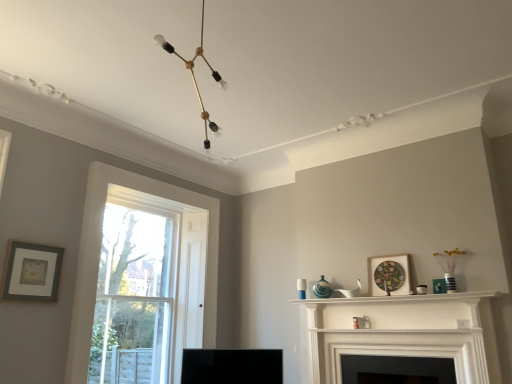
Describe the element at coordinates (401, 299) in the screenshot. I see `white glossy shelf at upper center` at that location.

What do you see at coordinates (32, 272) in the screenshot?
I see `matte gray picture frame at left, the 2th picture frame when ordered from right to left` at bounding box center [32, 272].

Identify the location of matte gray picture frame at left, the 2th picture frame when ordered from right to left. (32, 272).

The width and height of the screenshot is (512, 384). What do you see at coordinates (401, 355) in the screenshot?
I see `black matte fireplace at center, the first fireplace when ordered from bottom to top` at bounding box center [401, 355].

Measure the distance between matte wooden picture frame at upper right, which is the first picture frame in right-to-left order, and camera.

matte wooden picture frame at upper right, which is the first picture frame in right-to-left order, and camera are 3.60 meters apart.

At what (x,y) coordinates should I click in order to perform the action: click on white glossy shelf at upper center. Please return your answer as a coordinate pair (x, y). Looking at the image, I should click on (401, 299).

Can you confirm if clear glass window at left is positioned to the right of white matte fireplace at center, which is the 1th fireplace from top to bottom?

No.

Considering the relative sizes of clear glass window at left and white matte fireplace at center, which is the 1th fireplace from top to bottom, in the image provided, is clear glass window at left bigger than white matte fireplace at center, which is the 1th fireplace from top to bottom,?

Indeed, clear glass window at left has a larger size compared to white matte fireplace at center, which is the 1th fireplace from top to bottom.

Is clear glass window at left facing away from white matte fireplace at center, the 2th fireplace in the bottom-to-top sequence?

No, clear glass window at left is not facing the opposite direction of white matte fireplace at center, the 2th fireplace in the bottom-to-top sequence.

Can you confirm if clear glass window at left is shorter than white matte fireplace at center, which is the 1th fireplace from top to bottom?

No.

Which is farther, (375,350) or (19,248)?

The point (375,350) is more distant.

Is black matte fireplace at center, the first fireplace when ordered from bottom to top, positioned beyond the bounds of matte gray picture frame at left, arranged as the 1th picture frame when viewed from the left?

Yes, black matte fireplace at center, the first fireplace when ordered from bottom to top, is outside of matte gray picture frame at left, arranged as the 1th picture frame when viewed from the left.

Is black matte fireplace at center, the second fireplace when ordered from top to bottom, aimed at matte gray picture frame at left, arranged as the 1th picture frame when viewed from the left?

No.

Find the location of `fireplace that is the 2nd one when counting downward from the matte gray picture frame at left, arranged as the 1th picture frame when viewed from the left (from the image's perspective)`. fireplace that is the 2nd one when counting downward from the matte gray picture frame at left, arranged as the 1th picture frame when viewed from the left (from the image's perspective) is located at coordinates (401, 355).

From the image's perspective, relative to black matte fireplace at center, the second fireplace when ordered from top to bottom, is white glossy shelf at upper center above or below?

Clearly, from the image's perspective, white glossy shelf at upper center is above black matte fireplace at center, the second fireplace when ordered from top to bottom.

Which of these two, white glossy shelf at upper center or black matte fireplace at center, the first fireplace when ordered from bottom to top, is smaller?

With smaller size is white glossy shelf at upper center.

Could you measure the distance between white glossy shelf at upper center and black matte fireplace at center, the first fireplace when ordered from bottom to top?

15.54 inches.

Is black matte fireplace at center, the first fireplace when ordered from bottom to top, surrounded by white glossy shelf at upper center?

No, white glossy shelf at upper center does not contain black matte fireplace at center, the first fireplace when ordered from bottom to top.

Does white matte fireplace at center, which is the 1th fireplace from top to bottom, contain black matte fireplace at center, the first fireplace when ordered from bottom to top?

Definitely not — black matte fireplace at center, the first fireplace when ordered from bottom to top, is not inside white matte fireplace at center, which is the 1th fireplace from top to bottom.

Is point (426, 313) closer or farther from the camera than point (410, 348)?

Clearly, point (426, 313) is more distant from the camera than point (410, 348).

Is white matte fireplace at center, which is the 1th fireplace from top to bottom, facing towards black matte fireplace at center, the first fireplace when ordered from bottom to top?

Yes, white matte fireplace at center, which is the 1th fireplace from top to bottom, is facing black matte fireplace at center, the first fireplace when ordered from bottom to top.

Considering the relative sizes of white glossy shelf at upper center and matte wooden picture frame at upper right, which is the first picture frame in right-to-left order, in the image provided, is white glossy shelf at upper center bigger than matte wooden picture frame at upper right, which is the first picture frame in right-to-left order,?

Yes, white glossy shelf at upper center is bigger than matte wooden picture frame at upper right, which is the first picture frame in right-to-left order.

From the image's perspective, does white glossy shelf at upper center appear lower than matte wooden picture frame at upper right, acting as the 2th picture frame starting from the left?

Yes, from the image's perspective, white glossy shelf at upper center is beneath matte wooden picture frame at upper right, acting as the 2th picture frame starting from the left.

Is white glossy shelf at upper center facing away from matte wooden picture frame at upper right, acting as the 2th picture frame starting from the left?

white glossy shelf at upper center does not have its back to matte wooden picture frame at upper right, acting as the 2th picture frame starting from the left.

Between white glossy shelf at upper center and matte wooden picture frame at upper right, acting as the 2th picture frame starting from the left, which one has smaller width?

matte wooden picture frame at upper right, acting as the 2th picture frame starting from the left.

Who is taller, matte gray picture frame at left, arranged as the 1th picture frame when viewed from the left, or matte wooden picture frame at upper right, which is the first picture frame in right-to-left order?

With more height is matte gray picture frame at left, arranged as the 1th picture frame when viewed from the left.

Would you say matte gray picture frame at left, the 2th picture frame when ordered from right to left, is a long distance from matte wooden picture frame at upper right, acting as the 2th picture frame starting from the left?

Yes, matte gray picture frame at left, the 2th picture frame when ordered from right to left, and matte wooden picture frame at upper right, acting as the 2th picture frame starting from the left, are quite far apart.

What's the angular difference between matte gray picture frame at left, arranged as the 1th picture frame when viewed from the left, and matte wooden picture frame at upper right, acting as the 2th picture frame starting from the left,'s facing directions?

matte gray picture frame at left, arranged as the 1th picture frame when viewed from the left, and matte wooden picture frame at upper right, acting as the 2th picture frame starting from the left, are facing 88.1 degrees away from each other.

Who is smaller, matte gray picture frame at left, the 2th picture frame when ordered from right to left, or matte wooden picture frame at upper right, acting as the 2th picture frame starting from the left?

matte gray picture frame at left, the 2th picture frame when ordered from right to left, is smaller.

From the image's perspective, which is below, white matte fireplace at center, the 2th fireplace in the bottom-to-top sequence, or matte wooden picture frame at upper right, which is the first picture frame in right-to-left order?

white matte fireplace at center, the 2th fireplace in the bottom-to-top sequence.

Considering the sizes of objects white matte fireplace at center, the 2th fireplace in the bottom-to-top sequence, and matte wooden picture frame at upper right, acting as the 2th picture frame starting from the left, in the image provided, who is bigger, white matte fireplace at center, the 2th fireplace in the bottom-to-top sequence, or matte wooden picture frame at upper right, acting as the 2th picture frame starting from the left,?

white matte fireplace at center, the 2th fireplace in the bottom-to-top sequence.

This screenshot has height=384, width=512. I want to click on picture frame on the right of the white matte fireplace at center, the 2th fireplace in the bottom-to-top sequence, so [389, 275].

Are white matte fireplace at center, which is the 1th fireplace from top to bottom, and matte wooden picture frame at upper right, acting as the 2th picture frame starting from the left, making contact?

They are not placed beside each other.

Starting from the clear glass window at left, which fireplace is the 2nd one in front? Please provide its 2D coordinates.

[(405, 332)]

From a real-world perspective, starting from the matte gray picture frame at left, arranged as the 1th picture frame when viewed from the left, which fireplace is the 2nd one below it? Please provide its 2D coordinates.

[(401, 355)]

From the image, which object appears to be farther from matte gray picture frame at left, arranged as the 1th picture frame when viewed from the left, black matte fireplace at center, the second fireplace when ordered from top to bottom, or clear glass window at left?

Among the two, black matte fireplace at center, the second fireplace when ordered from top to bottom, is located further to matte gray picture frame at left, arranged as the 1th picture frame when viewed from the left.

Based on their spatial positions, is matte gray picture frame at left, the 2th picture frame when ordered from right to left, or clear glass window at left closer to white matte fireplace at center, which is the 1th fireplace from top to bottom?

clear glass window at left.

In the scene shown: Looking at the image, which one is located further to matte wooden picture frame at upper right, acting as the 2th picture frame starting from the left, black matte fireplace at center, the second fireplace when ordered from top to bottom, or white glossy shelf at upper center?

Based on the image, black matte fireplace at center, the second fireplace when ordered from top to bottom, appears to be further to matte wooden picture frame at upper right, acting as the 2th picture frame starting from the left.

Estimate the real-world distances between objects in this image. Which object is closer to white glossy shelf at upper center, black matte fireplace at center, the first fireplace when ordered from bottom to top, or matte gray picture frame at left, arranged as the 1th picture frame when viewed from the left?

black matte fireplace at center, the first fireplace when ordered from bottom to top, lies closer to white glossy shelf at upper center than the other object.

From the image, which object appears to be nearer to black matte fireplace at center, the second fireplace when ordered from top to bottom, clear glass window at left or matte wooden picture frame at upper right, acting as the 2th picture frame starting from the left?

Based on the image, matte wooden picture frame at upper right, acting as the 2th picture frame starting from the left, appears to be nearer to black matte fireplace at center, the second fireplace when ordered from top to bottom.

From the image, which object appears to be nearer to matte gray picture frame at left, arranged as the 1th picture frame when viewed from the left, white glossy shelf at upper center or clear glass window at left?

clear glass window at left is positioned closer to the anchor matte gray picture frame at left, arranged as the 1th picture frame when viewed from the left.

Looking at the image, which one is located closer to white glossy shelf at upper center, white matte fireplace at center, the 2th fireplace in the bottom-to-top sequence, or clear glass window at left?

The object closer to white glossy shelf at upper center is white matte fireplace at center, the 2th fireplace in the bottom-to-top sequence.

Looking at this image, when comparing their distances from matte gray picture frame at left, arranged as the 1th picture frame when viewed from the left, does white matte fireplace at center, the 2th fireplace in the bottom-to-top sequence, or white glossy shelf at upper center seem closer?

white glossy shelf at upper center is positioned closer to the anchor matte gray picture frame at left, arranged as the 1th picture frame when viewed from the left.

Identify the location of shelf between gold metallic chandelier at upper center and black matte fireplace at center, the first fireplace when ordered from bottom to top, in the up-down direction. (401, 299).

Find the location of a particular element. The width and height of the screenshot is (512, 384). fireplace between matte gray picture frame at left, the 2th picture frame when ordered from right to left, and matte wooden picture frame at upper right, acting as the 2th picture frame starting from the left is located at coordinates (405, 332).

Where is `light fixture between clear glass window at left and white matte fireplace at center, which is the 1th fireplace from top to bottom`? light fixture between clear glass window at left and white matte fireplace at center, which is the 1th fireplace from top to bottom is located at coordinates (195, 78).

You are a GUI agent. You are given a task and a screenshot of the screen. Output one action in this format:
    pyautogui.click(x=<x>, y=<y>)
    Task: Click on the bay window between matte gray picture frame at left, arranged as the 1th picture frame when viewed from the left, and white matte fireplace at center, the 2th fireplace in the bottom-to-top sequence, in the horizontal direction
    The height and width of the screenshot is (384, 512).
    Given the screenshot: What is the action you would take?
    pyautogui.click(x=134, y=297)